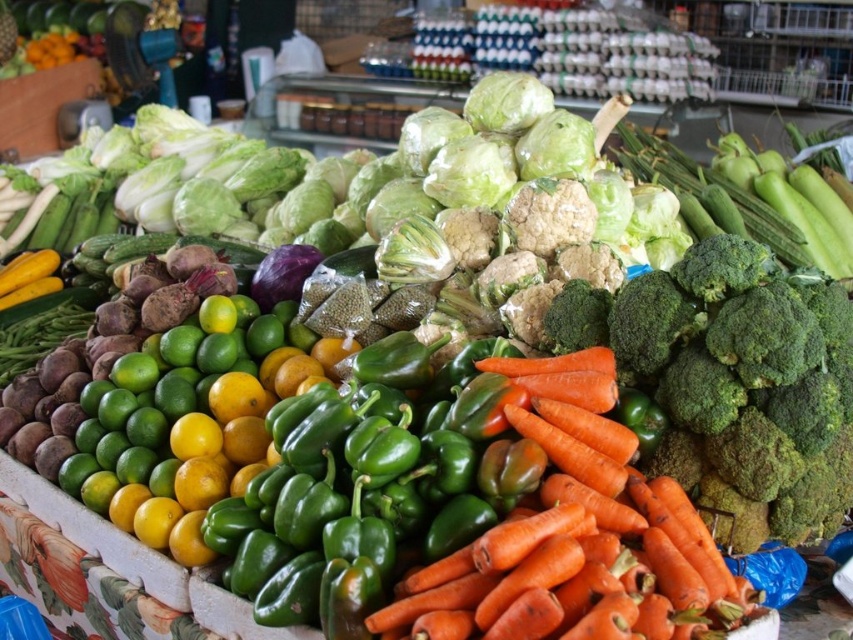
Consider the image. You are a vendor at the market and want to pack these vegetables into a box. The box can only hold items that are narrower than 10 centimeters. You have the orange rough carrots at center and the green matte broccoli at right. Which of these vegetables can you safely place in the box?

The orange rough carrots at center might be wider than green matte broccoli at right, so the green matte broccoli at right is more likely to fit in the box since it is narrower.

You are a customer at the market stall and want to find the green matte broccoli at right. According to the layout, where should you look relative to the pile of green limes and oranges?

The green matte broccoli at right is located at point (746, 380), which is to the right of the pile of green limes and oranges.